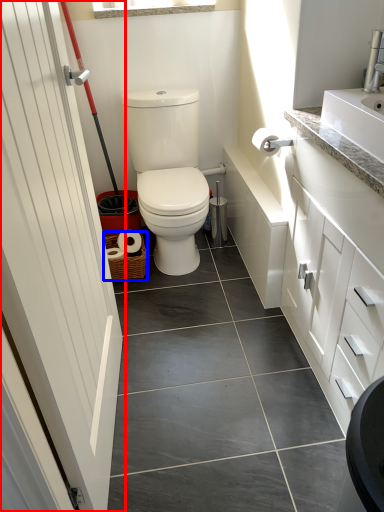
Question: Which point is closer to the camera, door (highlighted by a red box) or basket (highlighted by a blue box)?

Choices:
 (A) door
 (B) basket

Answer: (A)